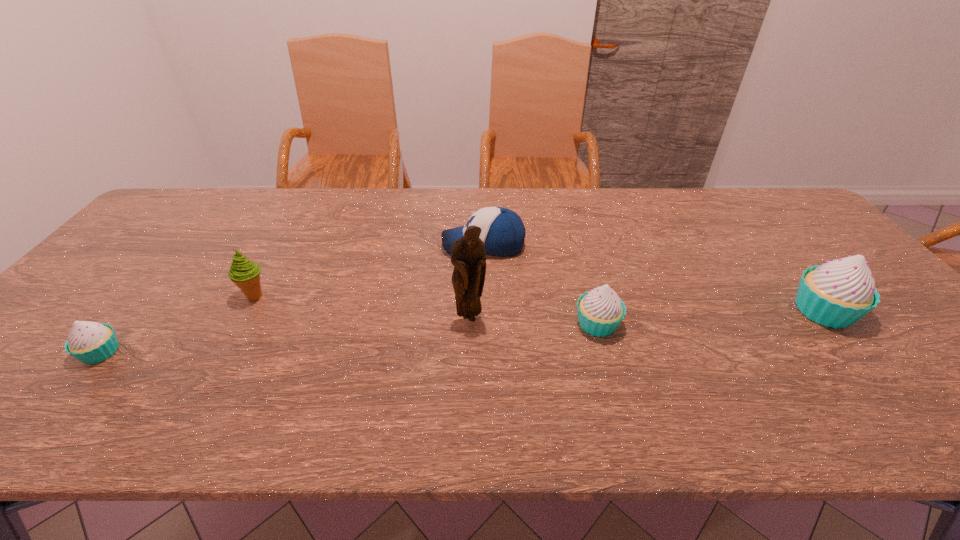
Locate an element on the screen. vacant area between the rightmost object and the second object from right to left is located at coordinates (710, 318).

Find the location of a particular element. vacant area that lies between the farthest object and the tallest cupcake is located at coordinates (654, 278).

Where is `empty location between the second object from right to left and the icecream`? This screenshot has height=540, width=960. empty location between the second object from right to left and the icecream is located at coordinates 426,310.

The image size is (960, 540). I want to click on free space between the tallest cupcake and the second cupcake from right to left, so click(x=710, y=318).

Locate an element on the screen. free space that is in between the icecream and the tallest object is located at coordinates (363, 307).

I want to click on free space between the tallest cupcake and the icecream, so click(x=540, y=303).

I want to click on vacant region between the shortest cupcake and the second tallest cupcake, so click(349, 338).

Locate an element on the screen. This screenshot has width=960, height=540. blank region between the second cupcake from right to left and the baseball cap is located at coordinates (540, 285).

Point out which object is positioned as the fifth nearest to the second cupcake from right to left. Please provide its 2D coordinates. Your answer should be formatted as a tuple, i.e. [(x, y)], where the tuple contains the x and y coordinates of a point satisfying the conditions above.

[(90, 342)]

Locate which object ranks third in proximity to the figurine. Please provide its 2D coordinates. Your answer should be formatted as a tuple, i.e. [(x, y)], where the tuple contains the x and y coordinates of a point satisfying the conditions above.

[(244, 273)]